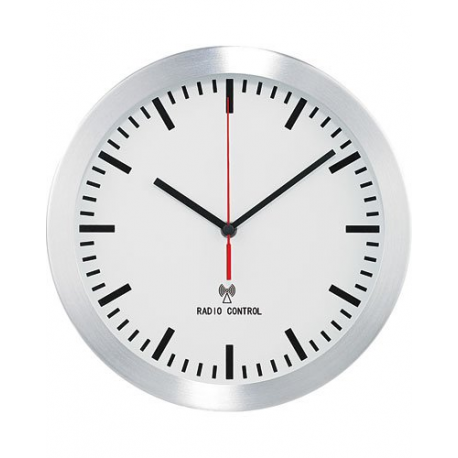
This screenshot has height=458, width=458. In order to click on round clock in this screenshot , I will do `click(228, 225)`.